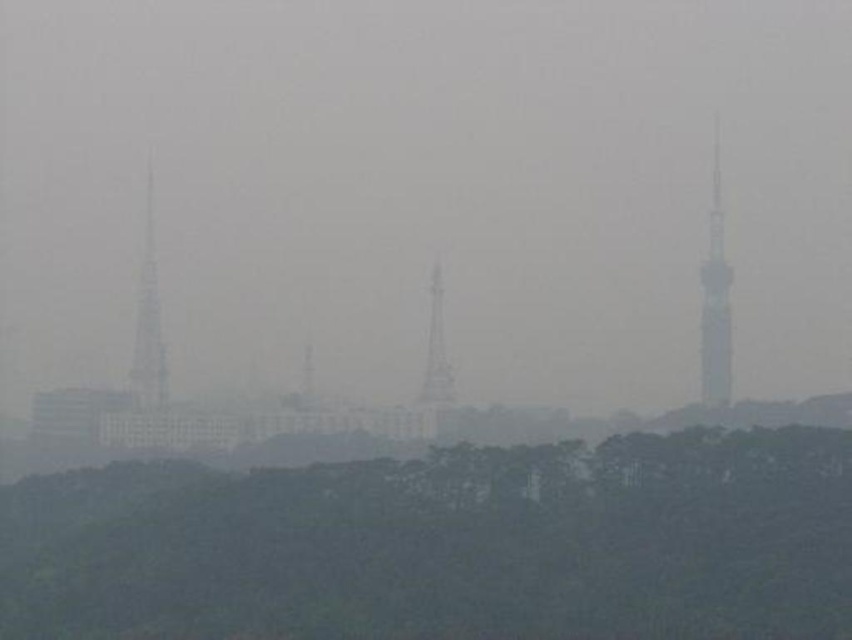
Question: Does dark green foliage at lower center have a larger size compared to metallic silver tower at right?

Choices:
 (A) no
 (B) yes

Answer: (B)

Question: Considering the real-world distances, which object is farthest from the metallic silver tower at right?

Choices:
 (A) dark green foliage at lower center
 (B) smokey metallic tower at left
 (C) smokey gray tower at center

Answer: (B)

Question: Which of the following is the farthest from the observer?

Choices:
 (A) (821, 440)
 (B) (439, 310)

Answer: (A)

Question: Which point is closer to the camera?

Choices:
 (A) (715, 184)
 (B) (423, 381)

Answer: (B)

Question: Can you confirm if dark green foliage at lower center is thinner than metallic silver tower at right?

Choices:
 (A) yes
 (B) no

Answer: (B)

Question: Considering the relative positions of metallic silver tower at right and smokey metallic tower at left in the image provided, where is metallic silver tower at right located with respect to smokey metallic tower at left?

Choices:
 (A) above
 (B) below

Answer: (A)